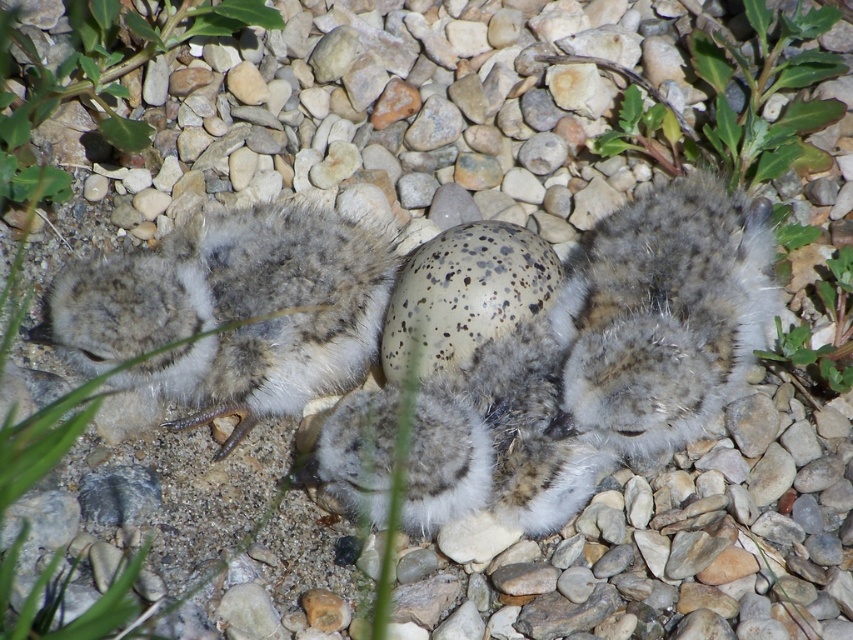
You are a wildlife photographer aiming to capture a closeup of the soft gray downy chick at center without disturbing it. If your camera lens has a minimum focusing distance of 3 feet, will you be able to take the photo from your current position?

The soft gray downy chick at center is 3.76 feet away from the camera. Since the minimum focusing distance is 3 feet, you are within the required range and can take the photo without moving closer.

You are a wildlife photographer observing the two birds in the image. You notice that one is a soft gray downy chick at center and the other is a fuzzy gray bird at center. Based on their positions, which bird is closer to the camera?

The soft gray downy chick at center is closer to the camera because it is positioned below the fuzzy gray bird at center, indicating it is in a lower plane and thus nearer to the viewer.